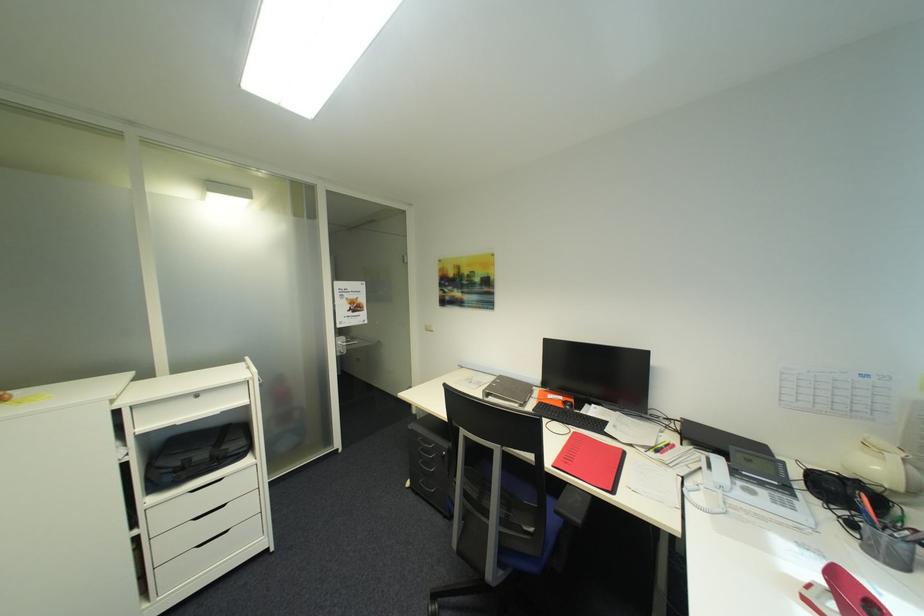
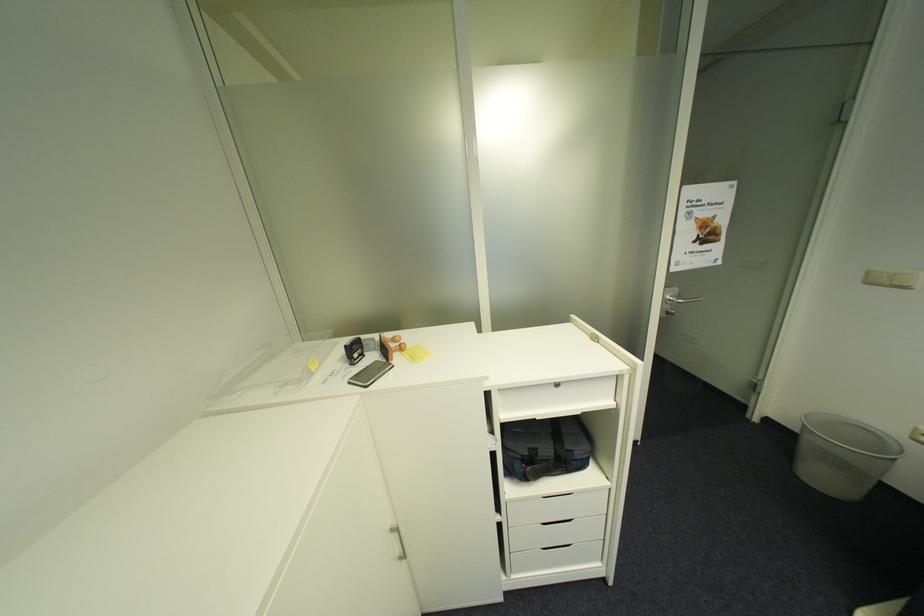
In the second image, find the point that corresponds to (434,331) in the first image.

(876, 284)